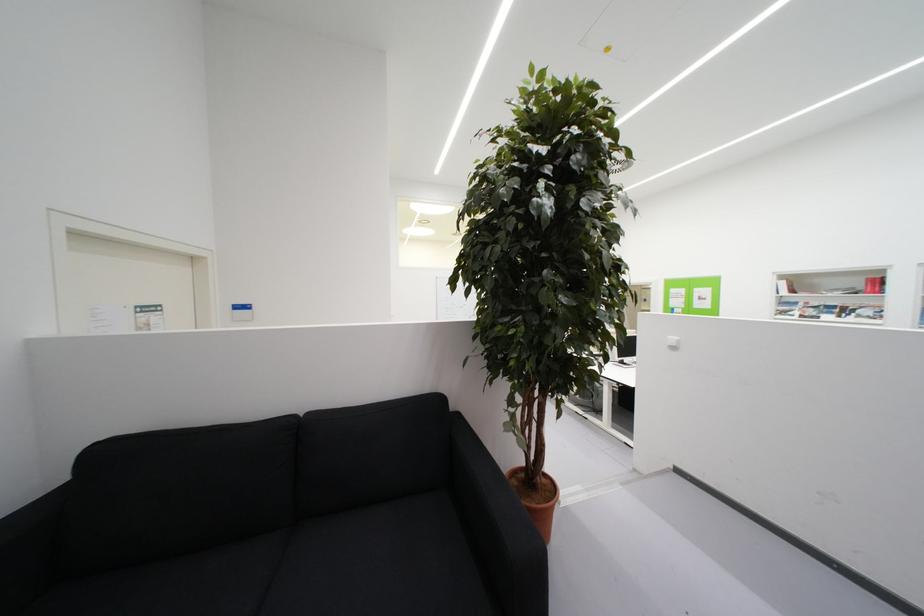
Where would you lift the brown plant pot? Please return your answer as a coordinate pair (x, y).

(537, 501)